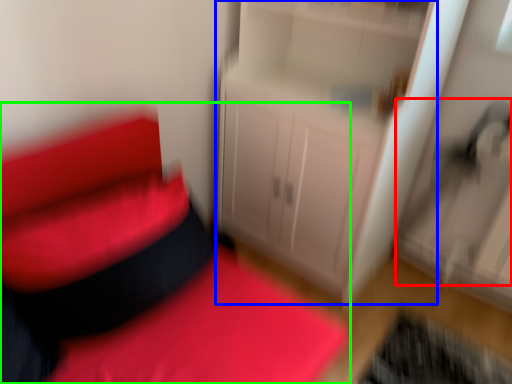
Question: Based on their relative distances, which object is farther from swivel chair (highlighted by a red box)? Choose from dresser (highlighted by a blue box) and furniture (highlighted by a green box).

Choices:
 (A) dresser
 (B) furniture

Answer: (B)